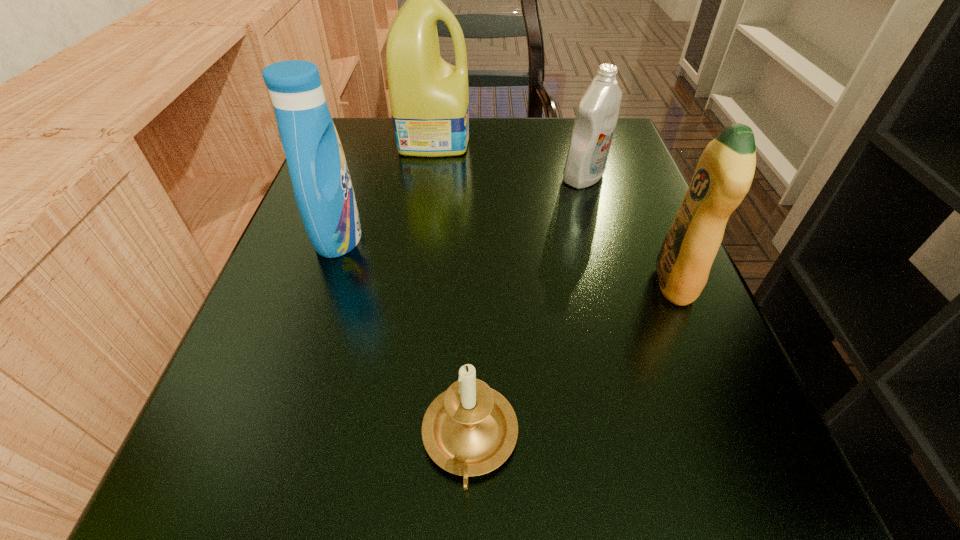
I want to click on free space that is in between the leftmost object and the rightmost object, so click(x=506, y=260).

Find the location of a particular element. This screenshot has height=540, width=960. free space between the third detergent from right to left and the rightmost object is located at coordinates (554, 211).

The image size is (960, 540). Identify the location of free spot between the rightmost object and the third nearest detergent. (629, 230).

Identify which object is located as the nearest to the rightmost object. Please provide its 2D coordinates. Your answer should be formatted as a tuple, i.e. [(x, y)], where the tuple contains the x and y coordinates of a point satisfying the conditions above.

[(596, 118)]

This screenshot has width=960, height=540. Identify the location of the third closest object to the rightmost object. (429, 98).

Identify which detergent is located as the third nearest to the shortest detergent. Please provide its 2D coordinates. Your answer should be formatted as a tuple, i.e. [(x, y)], where the tuple contains the x and y coordinates of a point satisfying the conditions above.

[(323, 190)]

Identify which detergent is the third nearest to the rightmost detergent. Please provide its 2D coordinates. Your answer should be formatted as a tuple, i.e. [(x, y)], where the tuple contains the x and y coordinates of a point satisfying the conditions above.

[(323, 190)]

The width and height of the screenshot is (960, 540). Identify the location of vacant space that satisfies the following two spatial constraints: 1. on the label of the farthest detergent; 2. on the left side of the shortest detergent. [x=429, y=177].

At what (x,y) coordinates should I click in order to perform the action: click on free space in the image that satisfies the following two spatial constraints: 1. on the label of the rightmost detergent; 2. with a handle on the side of the candle holder. Please return your answer as a coordinate pair (x, y). Image resolution: width=960 pixels, height=540 pixels. Looking at the image, I should click on pyautogui.click(x=739, y=441).

The image size is (960, 540). Find the location of `vacant space that satisfies the following two spatial constraints: 1. on the front side of the fourth nearest object; 2. on the front-facing side of the leftmost detergent`. vacant space that satisfies the following two spatial constraints: 1. on the front side of the fourth nearest object; 2. on the front-facing side of the leftmost detergent is located at coordinates (601, 237).